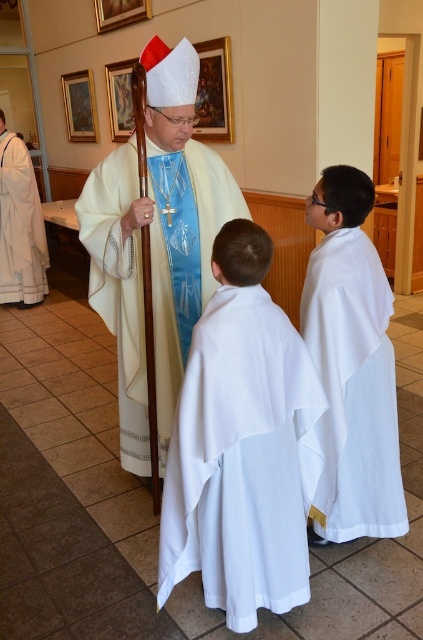
You are a visitor in the church and see both the white matte robe at center and the white satin robe at center. Which one is positioned lower in the image?

The white matte robe at center is below the white satin robe at center, so the white matte robe at center is positioned lower in the image.